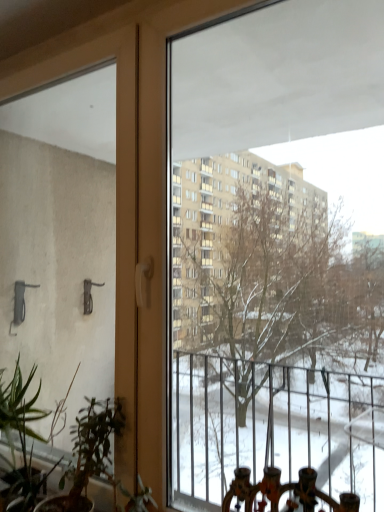
The height and width of the screenshot is (512, 384). Describe the element at coordinates (60, 457) in the screenshot. I see `green matte plant at lower left` at that location.

This screenshot has width=384, height=512. I want to click on green matte plant at lower left, so click(60, 457).

What do you see at coordinates (21, 435) in the screenshot? I see `green matte plant at lower left` at bounding box center [21, 435].

Identify the location of green matte plant at lower left. The image size is (384, 512). (21, 435).

This screenshot has width=384, height=512. Find the location of `green matte plant at lower left`. green matte plant at lower left is located at coordinates (x=60, y=457).

Which is more to the right, green matte plant at lower left or green matte plant at lower left?

Positioned to the right is green matte plant at lower left.

Between green matte plant at lower left and green matte plant at lower left, which one is positioned in front?

green matte plant at lower left.

Considering the positions of point (86, 472) and point (22, 494), is point (86, 472) closer or farther from the camera than point (22, 494)?

Point (86, 472) appears to be closer to the viewer than point (22, 494).

From the image's perspective, which one is positioned higher, green matte plant at lower left or green matte plant at lower left?

From the image's view, green matte plant at lower left is above.

From a real-world perspective, is green matte plant at lower left positioned above or below green matte plant at lower left?

From a real-world perspective, green matte plant at lower left is physically below green matte plant at lower left.

Is green matte plant at lower left thinner than green matte plant at lower left?

No.

Does green matte plant at lower left have a lesser height compared to green matte plant at lower left?

Yes, green matte plant at lower left is shorter than green matte plant at lower left.

Which of these two, green matte plant at lower left or green matte plant at lower left, is bigger?

green matte plant at lower left is bigger.

Is green matte plant at lower left completely or partially outside of green matte plant at lower left?

Indeed, green matte plant at lower left is completely outside green matte plant at lower left.

Is green matte plant at lower left positioned far away from green matte plant at lower left?

That's not correct — green matte plant at lower left is a little close to green matte plant at lower left.

Is green matte plant at lower left aimed at green matte plant at lower left?

No, green matte plant at lower left does not turn towards green matte plant at lower left.

How many degrees apart are the facing directions of green matte plant at lower left and green matte plant at lower left?

The angle between the facing direction of green matte plant at lower left and the facing direction of green matte plant at lower left is 0.000244 degrees.

The height and width of the screenshot is (512, 384). I want to click on houseplant in front of the green matte plant at lower left, so click(60, 457).

Considering the relative positions of green matte plant at lower left and green matte plant at lower left in the image provided, is green matte plant at lower left to the right of green matte plant at lower left from the viewer's perspective?

No, green matte plant at lower left is not to the right of green matte plant at lower left.

Considering their positions, is green matte plant at lower left located in front of or behind green matte plant at lower left?

green matte plant at lower left is behind green matte plant at lower left.

Considering the points (31, 471) and (73, 496), which point is behind, point (31, 471) or point (73, 496)?

Positioned behind is point (31, 471).

Based on the photo, from the image's perspective, is green matte plant at lower left over green matte plant at lower left?

Correct, green matte plant at lower left appears higher than green matte plant at lower left in the image.

From a real-world perspective, is green matte plant at lower left positioned above or below green matte plant at lower left?

In terms of real-world spatial position, green matte plant at lower left is above green matte plant at lower left.

Considering the sizes of objects green matte plant at lower left and green matte plant at lower left in the image provided, who is wider, green matte plant at lower left or green matte plant at lower left?

With larger width is green matte plant at lower left.

Is green matte plant at lower left taller or shorter than green matte plant at lower left?

In the image, green matte plant at lower left appears to be taller than green matte plant at lower left.

Does green matte plant at lower left have a smaller size compared to green matte plant at lower left?

Indeed, green matte plant at lower left has a smaller size compared to green matte plant at lower left.

Is green matte plant at lower left located outside green matte plant at lower left?

No.

Does green matte plant at lower left touch green matte plant at lower left?

Yes, green matte plant at lower left is touching green matte plant at lower left.

Could you tell me if green matte plant at lower left is facing green matte plant at lower left?

No, green matte plant at lower left does not turn towards green matte plant at lower left.

How different are the orientations of green matte plant at lower left and green matte plant at lower left in degrees?

The angular difference between green matte plant at lower left and green matte plant at lower left is 0.000244 degrees.

How much distance is there between green matte plant at lower left and green matte plant at lower left?

A distance of 5.64 centimeters exists between green matte plant at lower left and green matte plant at lower left.

The height and width of the screenshot is (512, 384). In order to click on houseplant located in front of the green matte plant at lower left in this screenshot , I will do `click(60, 457)`.

Image resolution: width=384 pixels, height=512 pixels. Find the location of `houseplant below the green matte plant at lower left (from the image's perspective)`. houseplant below the green matte plant at lower left (from the image's perspective) is located at coordinates (60, 457).

What are the coordinates of `houseplant in front of the green matte plant at lower left` in the screenshot? It's located at (60, 457).